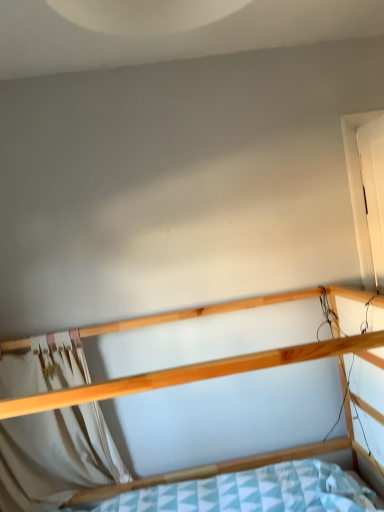
Question: Would you say white matte door at right is inside or outside white fabric curtain at lower left?

Choices:
 (A) inside
 (B) outside

Answer: (B)

Question: Is white matte door at right to the left or to the right of white fabric curtain at lower left in the image?

Choices:
 (A) left
 (B) right

Answer: (B)

Question: Estimate the real-world distances between objects in this image. Which object is farther from the natural wood bed at center?

Choices:
 (A) white matte door at right
 (B) white fabric curtain at lower left

Answer: (A)

Question: Which is nearer to the natural wood bed at center?

Choices:
 (A) white fabric curtain at lower left
 (B) white matte door at right

Answer: (A)